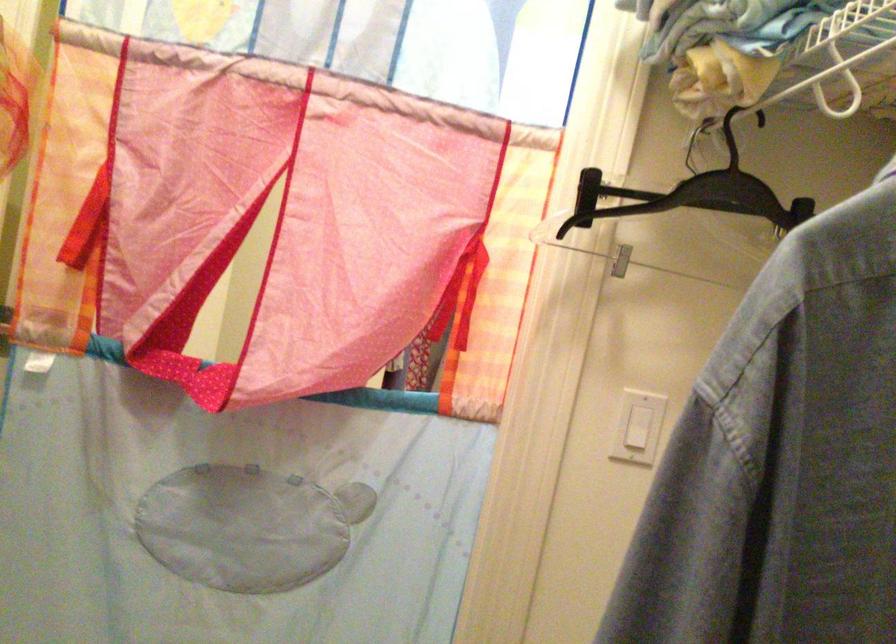
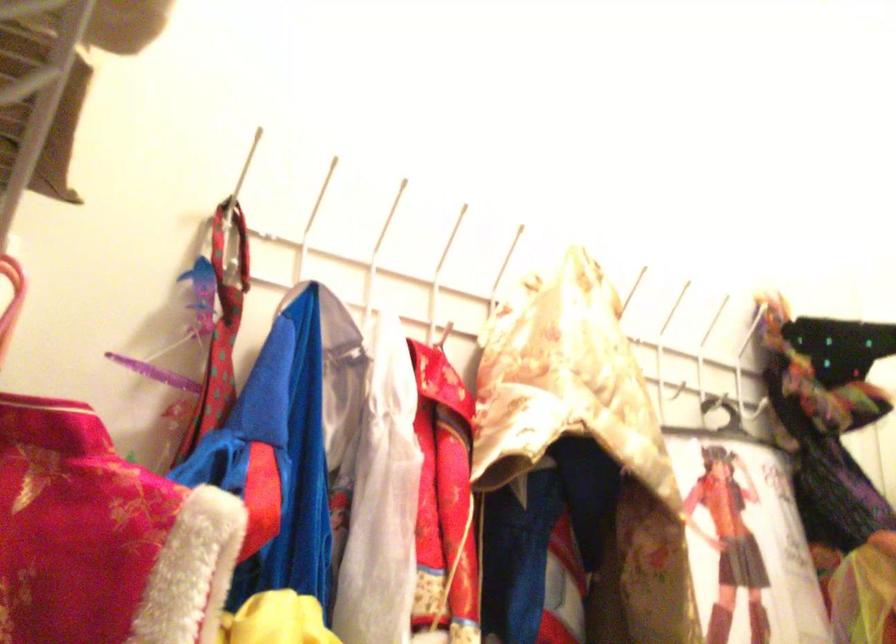
First-person continuous shooting, in which direction is the camera rotating?

The camera's rotation is toward left-up.